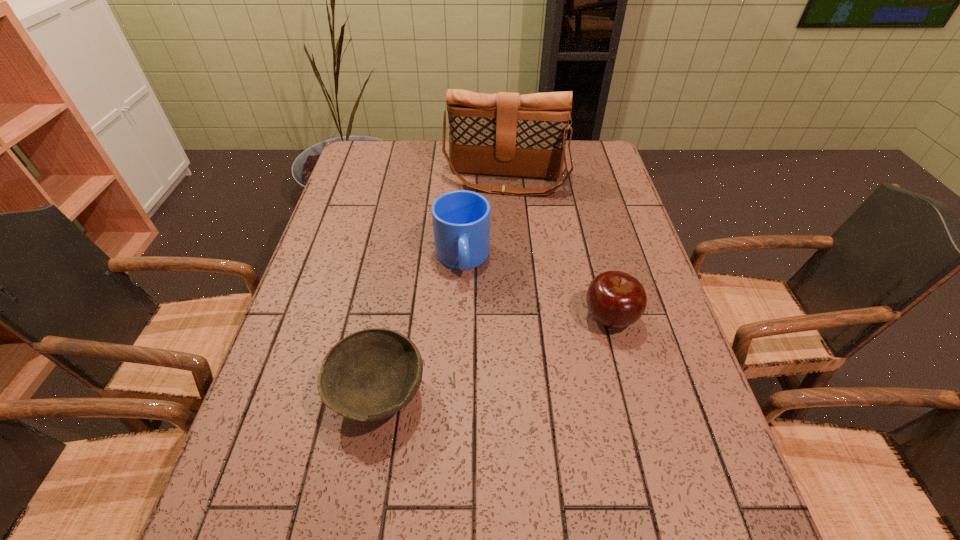
You are a GUI agent. You are given a task and a screenshot of the screen. Output one action in this format:
    pyautogui.click(x=<x>, y=<y>)
    Task: Click on the empty space between the shortest object and the tallest object
    Image resolution: width=960 pixels, height=540 pixels.
    Given the screenshot: What is the action you would take?
    pyautogui.click(x=442, y=287)

Where is `empty location between the shoulder bag and the shortest object`? The image size is (960, 540). empty location between the shoulder bag and the shortest object is located at coordinates (442, 287).

In order to click on free space that is in between the nearest object and the shoulder bag in this screenshot , I will do `click(442, 287)`.

The image size is (960, 540). In order to click on object that is the third closest to the shortest object in this screenshot , I will do `click(507, 134)`.

You are a GUI agent. You are given a task and a screenshot of the screen. Output one action in this format:
    pyautogui.click(x=<x>, y=<y>)
    Task: Click on the object that is the second closest one to the apple
    This screenshot has height=540, width=960.
    Given the screenshot: What is the action you would take?
    pyautogui.click(x=369, y=375)

Locate an element on the screen. free point that satisfies the following two spatial constraints: 1. on the back side of the bowl; 2. on the right side of the apple is located at coordinates (x=392, y=318).

This screenshot has width=960, height=540. I want to click on free location that satisfies the following two spatial constraints: 1. on the front side of the farthest object; 2. on the right side of the second nearest object, so click(x=516, y=318).

Where is `free space that satisfies the following two spatial constraints: 1. on the back side of the bowl; 2. on the left side of the farthest object`? Image resolution: width=960 pixels, height=540 pixels. free space that satisfies the following two spatial constraints: 1. on the back side of the bowl; 2. on the left side of the farthest object is located at coordinates (417, 180).